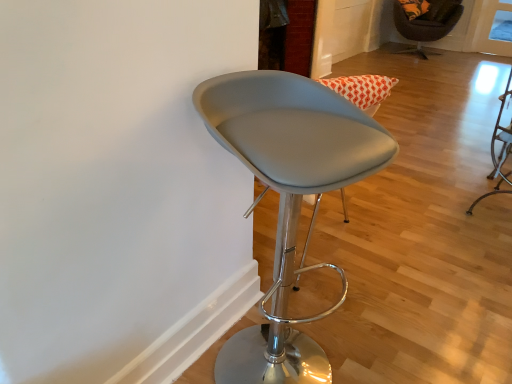
Question: From a real-world perspective, is satin gray stool at center, the 1th chair positioned from the front, above or below velvet-like brown chair at upper right, which appears as the 1th chair when viewed from the top?

Choices:
 (A) below
 (B) above

Answer: (B)

Question: Visually, is satin gray stool at center, which ranks as the second chair in top-to-bottom order, positioned to the left or to the right of velvet-like brown chair at upper right, positioned as the 1th chair in back-to-front order?

Choices:
 (A) right
 (B) left

Answer: (B)

Question: Is satin gray stool at center, the 1th chair in the left-to-right sequence, in front of or behind velvet-like brown chair at upper right, the second chair viewed from the front, in the image?

Choices:
 (A) behind
 (B) front

Answer: (B)

Question: Considering the positions of velvet-like brown chair at upper right, marked as the second chair in a bottom-to-top arrangement, and satin gray stool at center, the 1th chair in the left-to-right sequence, in the image, is velvet-like brown chair at upper right, marked as the second chair in a bottom-to-top arrangement, wider or thinner than satin gray stool at center, the 1th chair in the left-to-right sequence,?

Choices:
 (A) wide
 (B) thin

Answer: (A)

Question: Would you say velvet-like brown chair at upper right, the second chair viewed from the front, is to the left or to the right of satin gray stool at center, which ranks as the second chair in top-to-bottom order, in the picture?

Choices:
 (A) right
 (B) left

Answer: (A)

Question: In terms of size, does velvet-like brown chair at upper right, positioned as the 1th chair in back-to-front order, appear bigger or smaller than satin gray stool at center, arranged as the second chair when viewed from the back?

Choices:
 (A) small
 (B) big

Answer: (B)

Question: Is velvet-like brown chair at upper right, marked as the second chair in a bottom-to-top arrangement, in front of or behind satin gray stool at center, arranged as the second chair when viewed from the back, in the image?

Choices:
 (A) behind
 (B) front

Answer: (A)